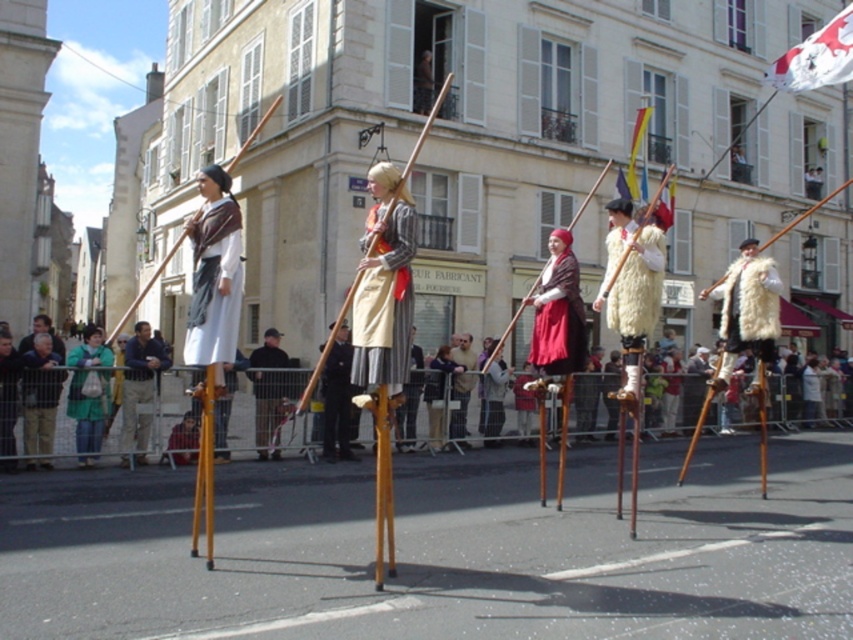
You are a photographer trying to capture the performers on stilts. You notice the beige fabric skirt at center and the white fur vest at center. Which one is positioned lower on the performer?

The beige fabric skirt at center is below the white fur vest at center, so the beige fabric skirt at center is positioned lower on the performer.

You are a photographer standing at the center of the street. You want to capture both the beige fabric skirt at center and the white fur vest at center in a single photo. What is the minimum distance you need to move backward to ensure both are fully visible in your camera frame?

The beige fabric skirt at center is 15.64 feet away from the white fur vest at center. To capture both in a single photo, you need to move back at least 15.64 feet to ensure both are within the camera frame.